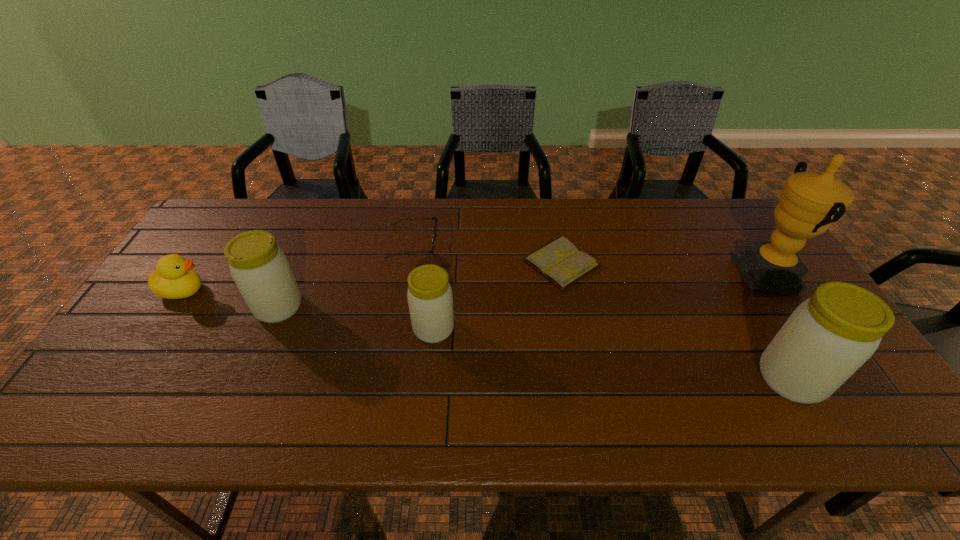
The image size is (960, 540). I want to click on vacant space that satisfies the following two spatial constraints: 1. at the front of the tallest object with handles; 2. on the front side of the second jar from right to left, so click(x=802, y=329).

At what (x,y) coordinates should I click in order to perform the action: click on vacant space that satisfies the following two spatial constraints: 1. at the beak of the nearest object; 2. on the left side of the leftmost object. Please return your answer as a coordinate pair (x, y). Image resolution: width=960 pixels, height=540 pixels. Looking at the image, I should click on (125, 379).

Locate an element on the screen. The height and width of the screenshot is (540, 960). free point that satisfies the following two spatial constraints: 1. on the front-facing side of the second jar from right to left; 2. on the left side of the spectacles is located at coordinates (397, 329).

Identify the location of blank space that satisfies the following two spatial constraints: 1. on the front side of the shortest jar; 2. on the right side of the second tallest jar. The width and height of the screenshot is (960, 540). (270, 329).

What are the coordinates of `free location that satisfies the following two spatial constraints: 1. on the back side of the diary; 2. on the left side of the third tallest object` in the screenshot? It's located at (298, 263).